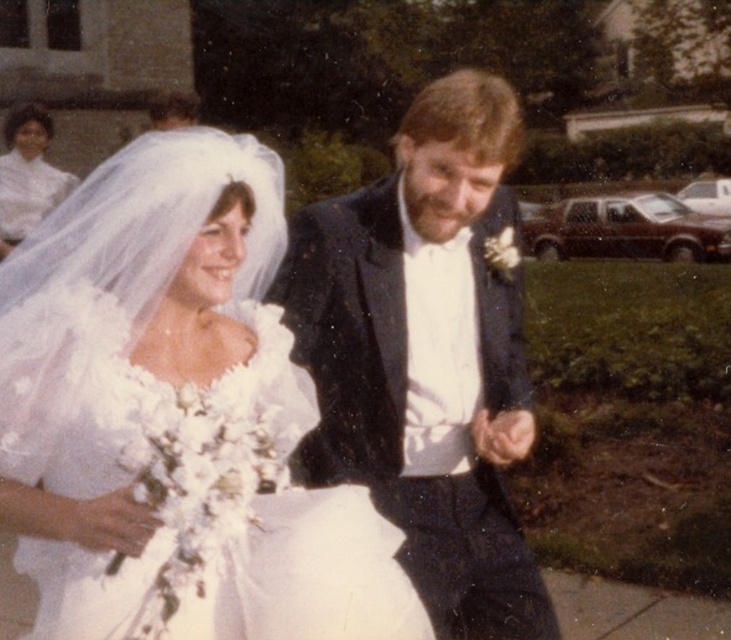
Does point (175, 387) lie in front of point (53, 195)?

Yes, it is.

Who is positioned more to the right, white satin dress at center or white satin dress at upper left?

white satin dress at center

Between point (352, 486) and point (49, 168), which one is positioned behind?

Positioned behind is point (49, 168).

At what (x,y) coordinates should I click in order to perform the action: click on white satin dress at center. Please return your answer as a coordinate pair (x, y). The width and height of the screenshot is (731, 640). Looking at the image, I should click on (175, 417).

Is point (80, 400) behind point (425, 260)?

No, (80, 400) is closer to viewer.

Can you confirm if white satin dress at center is shorter than shiny black tuxedo at center?

No.

The height and width of the screenshot is (640, 731). I want to click on white satin dress at center, so click(175, 417).

Does shiny black tuxedo at center have a greater height compared to white satin dress at upper left?

No.

The image size is (731, 640). What are the coordinates of `shiny black tuxedo at center` in the screenshot? It's located at (425, 355).